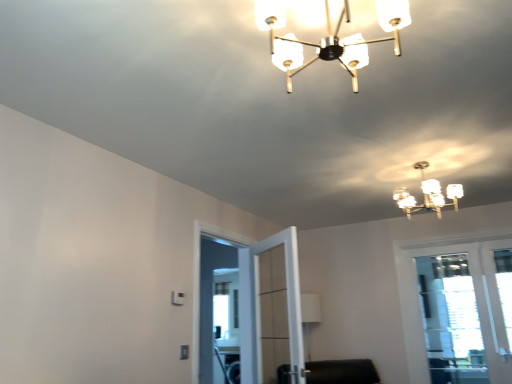
Question: Considering the relative positions of translucent glass chandelier at upper center, which is the 1th lamp in front-to-back order, and clear glass door at center in the image provided, is translucent glass chandelier at upper center, which is the 1th lamp in front-to-back order, to the left or to the right of clear glass door at center?

Choices:
 (A) right
 (B) left

Answer: (A)

Question: Does point (297, 54) appear closer or farther from the camera than point (247, 291)?

Choices:
 (A) farther
 (B) closer

Answer: (B)

Question: Which is nearer to the white frosted glass chandelier at upper center, which ranks as the 1th lamp in back-to-front order?

Choices:
 (A) translucent glass chandelier at upper center, which is the 2th lamp in back-to-front order
 (B) clear glass door at center
 (C) clear glass door at right

Answer: (C)

Question: Estimate the real-world distances between objects in this image. Which object is farther from the clear glass door at right?

Choices:
 (A) clear glass door at center
 (B) white frosted glass chandelier at upper center, which is the second lamp from left to right
 (C) translucent glass chandelier at upper center, positioned as the 1th lamp in top-to-bottom order

Answer: (C)